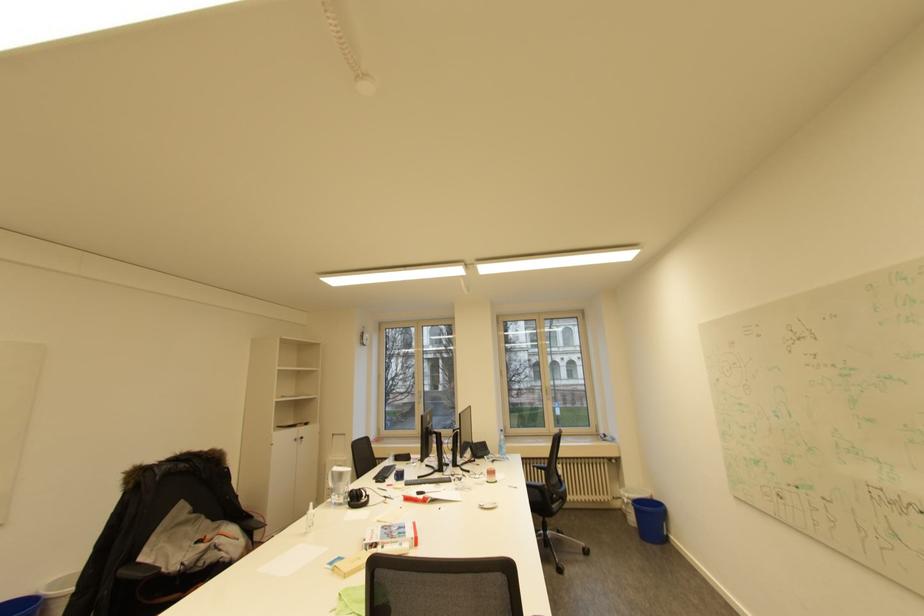
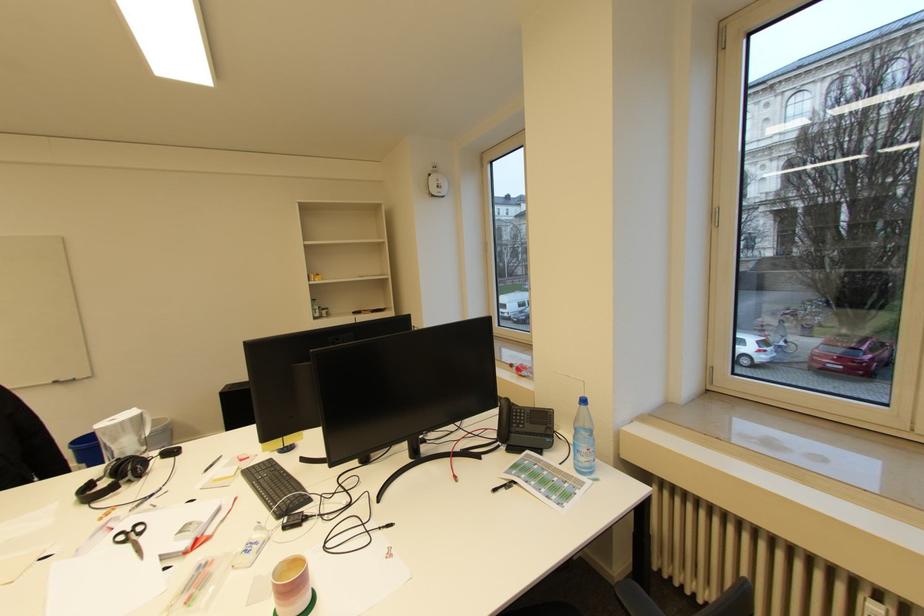
The point at [506,440] is marked in the first image. Where is the corresponding point in the second image?

(581, 429)